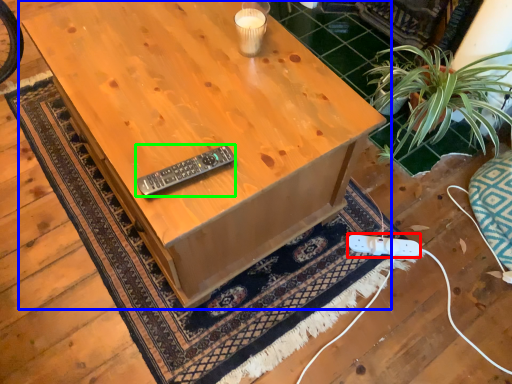
Question: Estimate the real-world distances between objects in this image. Which object is closer to plug (highlighted by a red box), table (highlighted by a blue box) or control (highlighted by a green box)?

Choices:
 (A) table
 (B) control

Answer: (A)